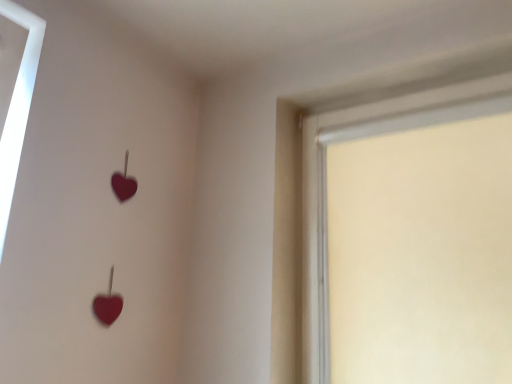
Question: Should I look upward or downward to see white matte window at upper right?

Choices:
 (A) up
 (B) down

Answer: (B)